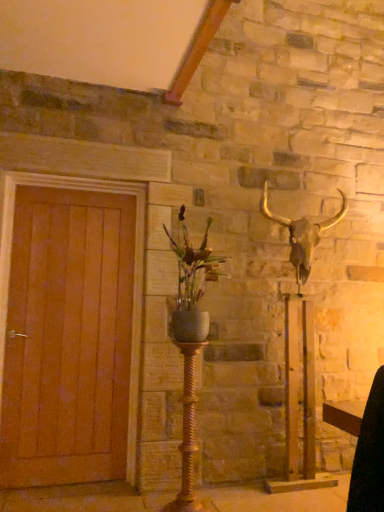
Question: From a real-world perspective, is gold twisted metal candle holder at center physically located above or below wooden door at left?

Choices:
 (A) above
 (B) below

Answer: (B)

Question: Relative to wooden door at left, is gold twisted metal candle holder at center in front or behind?

Choices:
 (A) front
 (B) behind

Answer: (A)

Question: Which object is the closest to the wooden door at left?

Choices:
 (A) gold twisted metal candle holder at center
 (B) matte gray vase at center
 (C) metallic gold bull skull at upper right

Answer: (B)

Question: Which of these objects is positioned farthest from the metallic gold bull skull at upper right?

Choices:
 (A) gold twisted metal candle holder at center
 (B) wooden door at left
 (C) matte gray vase at center

Answer: (B)